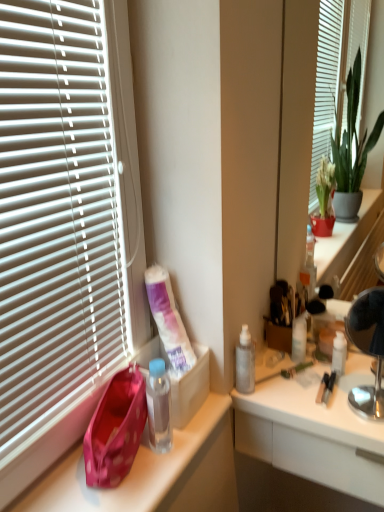
The image size is (384, 512). What are the coordinates of `vacant space in front of metallic silver mirror at right` in the screenshot? It's located at (320, 382).